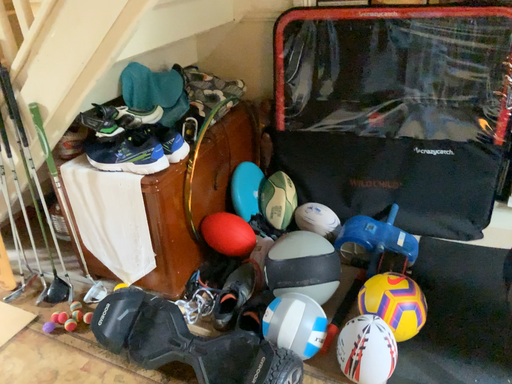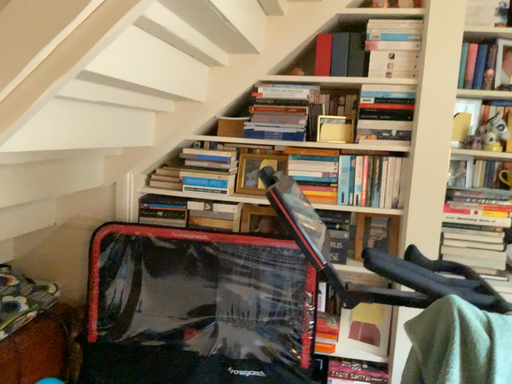
Question: How did the camera likely rotate when shooting the video?

Choices:
 (A) rotated upward
 (B) rotated downward

Answer: (A)